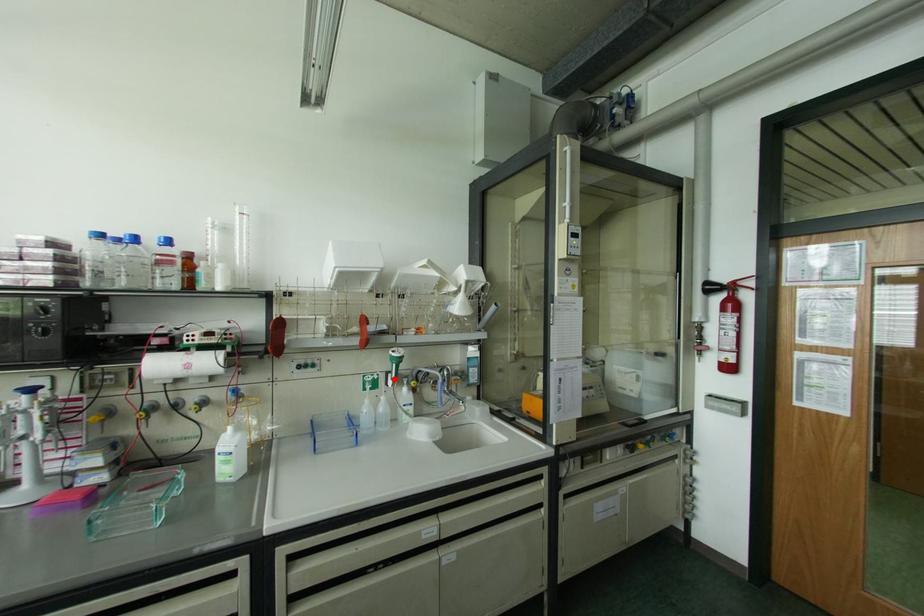
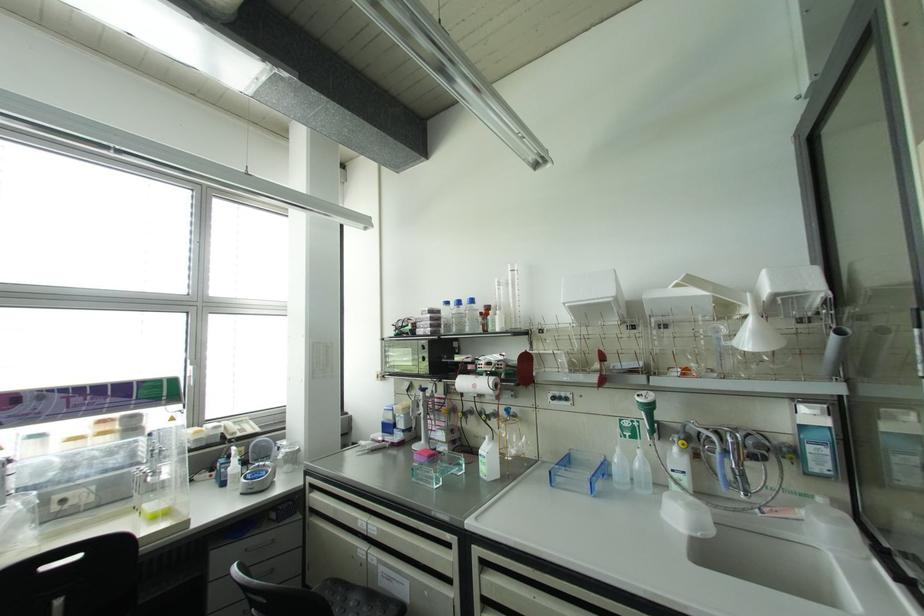
Locate, in the second image, the point that corresponds to the highlighted location in the first image.

(650, 432)